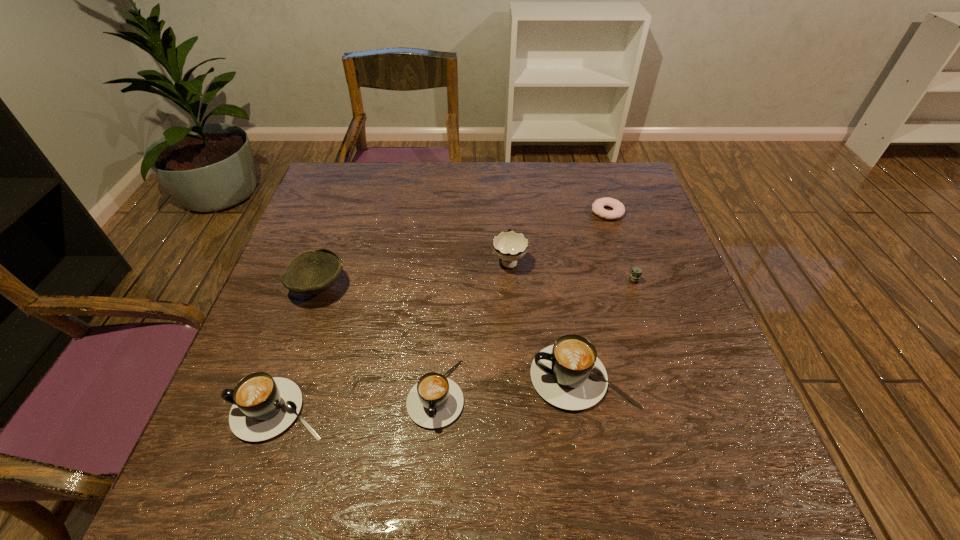
Where is `vacant area between the shortest object and the bowl`? vacant area between the shortest object and the bowl is located at coordinates (463, 249).

Identify the location of vacant point located between the second cappuccino from right to left and the rightmost cappuccino. (510, 385).

The image size is (960, 540). I want to click on vacant area between the bowl and the second shortest object, so click(x=476, y=284).

Locate an element on the screen. The width and height of the screenshot is (960, 540). free spot between the third object from left to right and the bowl is located at coordinates (377, 340).

The height and width of the screenshot is (540, 960). What are the coordinates of `unoccupied area between the rightmost cappuccino and the shortest object` in the screenshot? It's located at (595, 295).

Image resolution: width=960 pixels, height=540 pixels. Find the location of `free space between the bowl and the second shortest object`. free space between the bowl and the second shortest object is located at coordinates (476, 284).

Find the location of a particular element. vacant space that's between the bowl and the beer can is located at coordinates (476, 284).

Where is `free space between the second tallest cappuccino and the cup`? The height and width of the screenshot is (540, 960). free space between the second tallest cappuccino and the cup is located at coordinates (395, 335).

The height and width of the screenshot is (540, 960). Identify the location of blank region between the sixth tallest object and the bowl. (476, 284).

Identify which object is the nearest to the rightmost cappuccino. Please provide its 2D coordinates. Your answer should be formatted as a tuple, i.e. [(x, y)], where the tuple contains the x and y coordinates of a point satisfying the conditions above.

[(435, 401)]